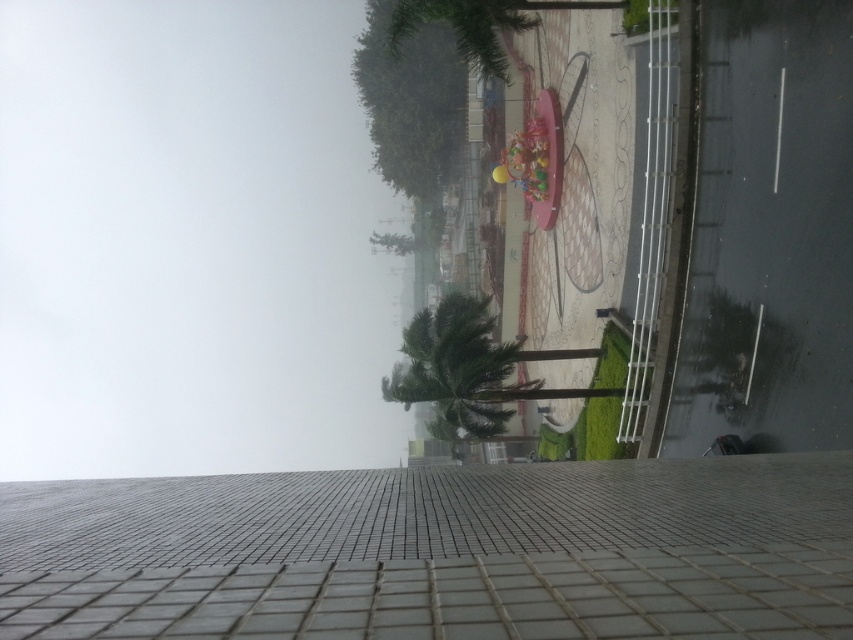
Question: Can you confirm if white fog at upper left is positioned above gray tile pavement at center?

Choices:
 (A) yes
 (B) no

Answer: (A)

Question: Does white fog at upper left appear over gray tile pavement at center?

Choices:
 (A) yes
 (B) no

Answer: (A)

Question: Is gray tile pavement at center smaller than green leafy palm tree at center?

Choices:
 (A) no
 (B) yes

Answer: (B)

Question: Which point is farther from the camera taking this photo?

Choices:
 (A) (28, 435)
 (B) (668, 596)

Answer: (A)

Question: Which object is closer to the camera taking this photo?

Choices:
 (A) gray tile pavement at center
 (B) green leafy palm tree at center
 (C) white fog at upper left

Answer: (A)

Question: Which object is closer to the camera taking this photo?

Choices:
 (A) white fog at upper left
 (B) green leafy palm tree at center

Answer: (B)